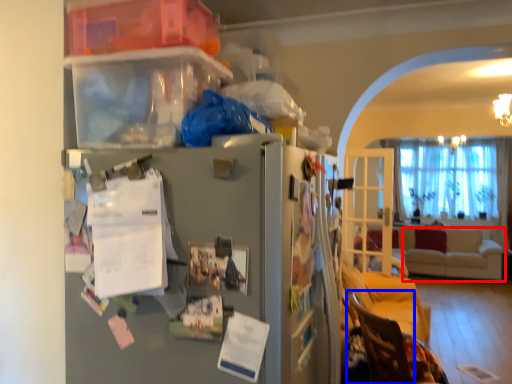
Question: Which point is closer to the camera, studio couch (highlighted by a red box) or armchair (highlighted by a blue box)?

Choices:
 (A) studio couch
 (B) armchair

Answer: (B)